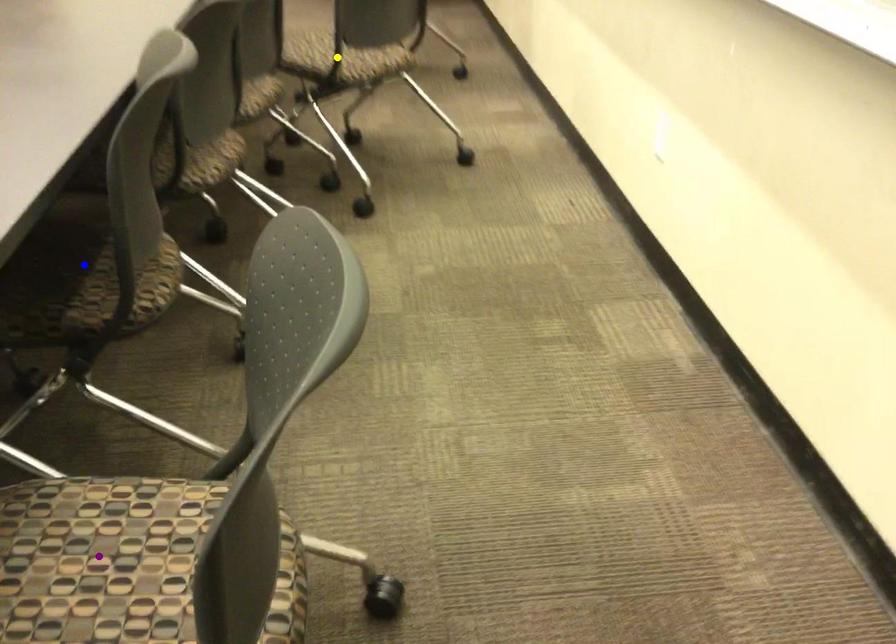
Order these from nearest to farthest:
- purple point
- blue point
- yellow point

yellow point → blue point → purple point